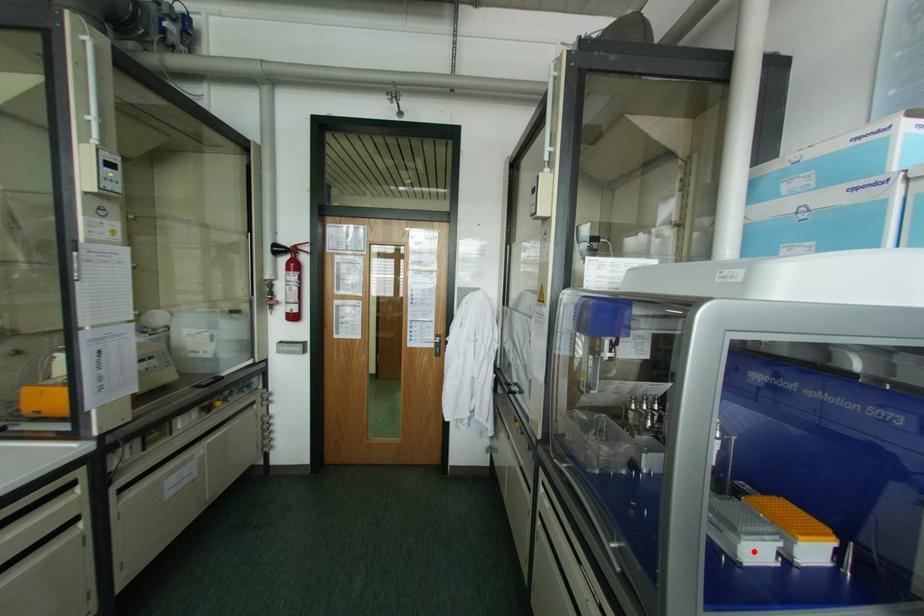
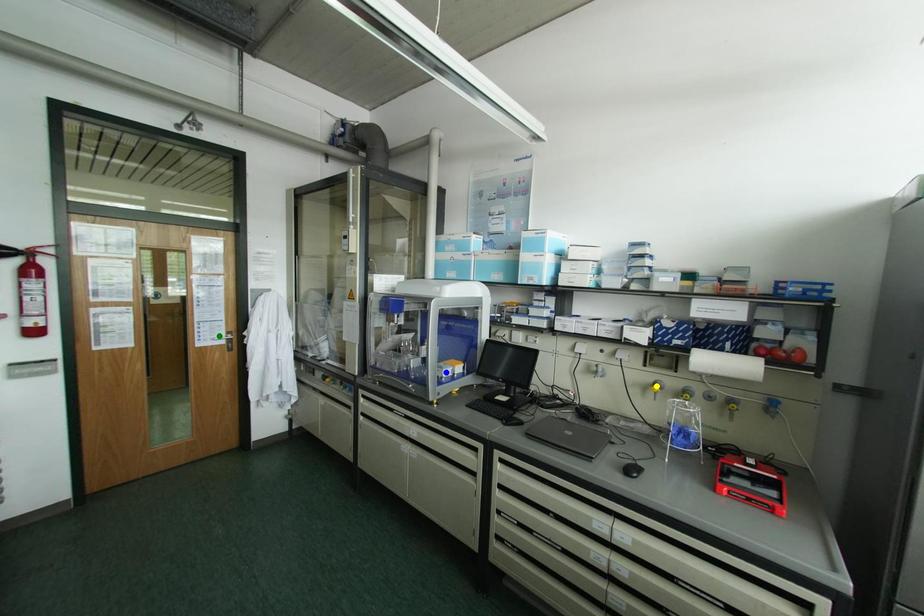
Question: I am providing you with two images of the same scene from different viewpoints. A red point is marked on the first image. You are given multiple points on the second image. Which point in image 2 represents the same 3d spot as the red point in image 1?

Choices:
 (A) yellow point
 (B) green point
 (C) blue point

Answer: (C)